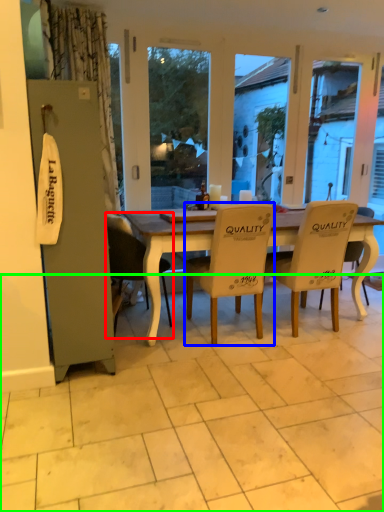
Question: Which object is positioned farthest from chair (highlighted by a red box)? Select from chair (highlighted by a blue box) and tile (highlighted by a green box).

Choices:
 (A) chair
 (B) tile

Answer: (B)